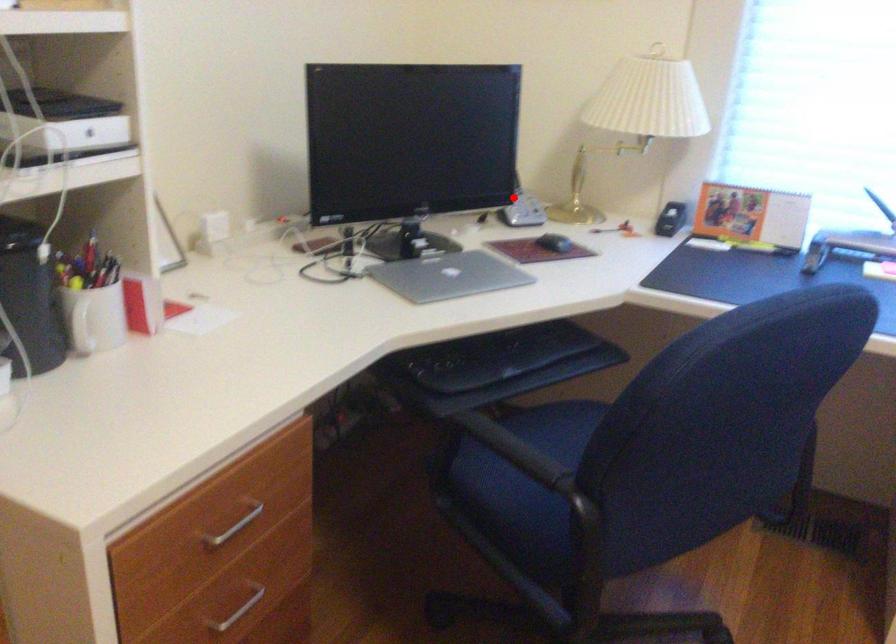
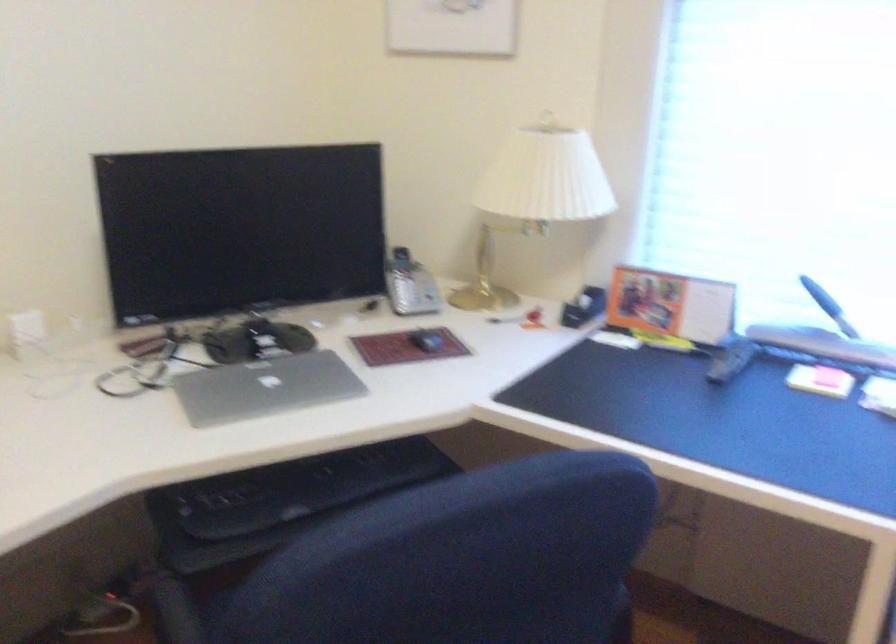
Where in the second image is the point corresponding to the highlighted location from the first image?

(401, 281)